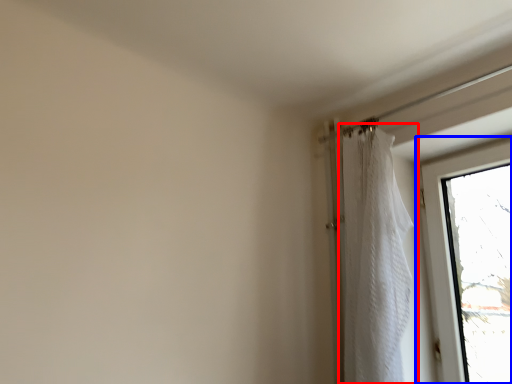
Question: Which point is further to the camera, curtain (highlighted by a red box) or window (highlighted by a blue box)?

Choices:
 (A) curtain
 (B) window

Answer: (B)